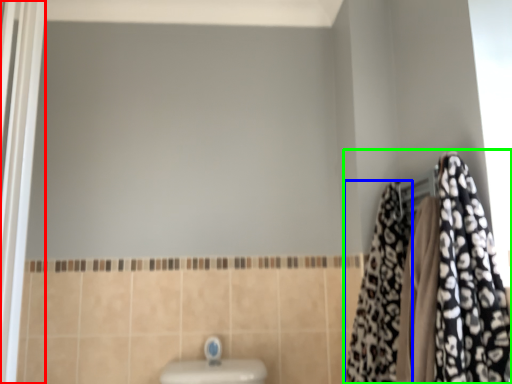
Question: Estimate the real-world distances between objects in this image. Which object is farther from screen door (highlighted by a red box), cloth (highlighted by a blue box) or closet (highlighted by a green box)?

Choices:
 (A) cloth
 (B) closet

Answer: (B)